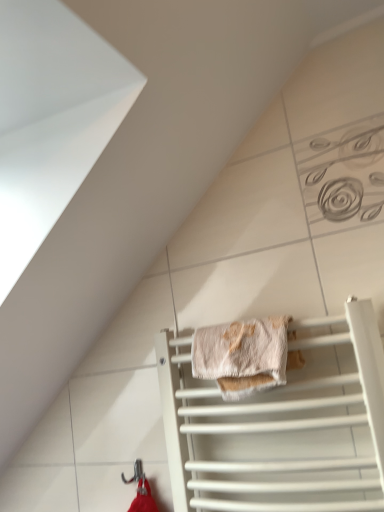
Question: From their relative heights in the image, would you say metallic hook at lower center is taller or shorter than white matte towel rack at lower center?

Choices:
 (A) tall
 (B) short

Answer: (B)

Question: Would you say metallic hook at lower center is to the left or to the right of white matte towel rack at lower center in the picture?

Choices:
 (A) right
 (B) left

Answer: (B)

Question: Which of these objects is positioned farthest from the white matte towel rack at lower center?

Choices:
 (A) beige textured towel at center
 (B) metallic hook at lower center

Answer: (B)

Question: Which of these objects is positioned farthest from the metallic hook at lower center?

Choices:
 (A) beige textured towel at center
 (B) white matte towel rack at lower center

Answer: (A)